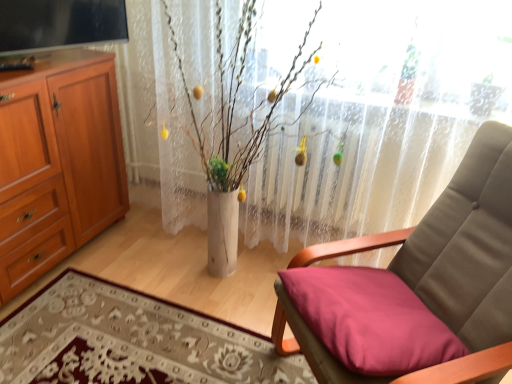
I want to click on matte beige cushion at center right, so click(444, 246).

What do you see at coordinates (369, 320) in the screenshot?
I see `matte pink cushion at lower right` at bounding box center [369, 320].

Identify the location of matte pink cushion at lower right. The height and width of the screenshot is (384, 512). pos(369,320).

Describe the element at coordinates (376, 126) in the screenshot. This screenshot has width=512, height=384. I see `white sheer curtain at center` at that location.

This screenshot has width=512, height=384. Find the location of `white sheer curtain at center`. white sheer curtain at center is located at coordinates (376, 126).

This screenshot has height=384, width=512. Describe the element at coordinates (131, 341) in the screenshot. I see `smooth fabric cushion at lower right` at that location.

Where is `matte beige cushion at center right`? The height and width of the screenshot is (384, 512). matte beige cushion at center right is located at coordinates (444, 246).

What are the coordinates of `cabinetry below the white sheer curtain at center (from the image's perspective)` in the screenshot? It's located at (57, 164).

From the picture: Between wooden cabinet at left and white sheer curtain at center, which one is positioned in front?

white sheer curtain at center.

Is point (116, 185) closer or farther from the camera than point (433, 146)?

Point (116, 185) is positioned farther from the camera compared to point (433, 146).

Consider the image. From the image's perspective, is matte beige cushion at center right positioned above or below matte pink cushion at lower right?

From the image's perspective, matte beige cushion at center right appears above matte pink cushion at lower right.

Does matte beige cushion at center right have a greater height compared to matte pink cushion at lower right?

Correct, matte beige cushion at center right is much taller as matte pink cushion at lower right.

Can you confirm if matte beige cushion at center right is positioned to the left of matte pink cushion at lower right?

In fact, matte beige cushion at center right is to the right of matte pink cushion at lower right.

Identify the location of chair above the matte pink cushion at lower right (from the image's perspective). This screenshot has height=384, width=512. (444, 246).

Which object is wider, smooth fabric cushion at lower right or white sheer curtain at center?

smooth fabric cushion at lower right is wider.

In the scene shown: What's the angular difference between smooth fabric cushion at lower right and white sheer curtain at center's facing directions?

The angle between the facing direction of smooth fabric cushion at lower right and the facing direction of white sheer curtain at center is 90.6 degrees.

Is smooth fabric cushion at lower right facing towards white sheer curtain at center?

No, smooth fabric cushion at lower right does not turn towards white sheer curtain at center.

Between smooth fabric cushion at lower right and white sheer curtain at center, which one is positioned behind?

white sheer curtain at center is further from the camera.

The image size is (512, 384). What are the coordinates of `plain below the white sheer curtain at center (from a real-world perspective)` in the screenshot? It's located at (131, 341).

Is white sheer curtain at center bigger or smaller than smooth fabric cushion at lower right?

Considering their sizes, white sheer curtain at center takes up more space than smooth fabric cushion at lower right.

Can you confirm if white sheer curtain at center is thinner than smooth fabric cushion at lower right?

Yes.

From the image's perspective, is matte beige cushion at center right located above smooth fabric cushion at lower right?

Correct, matte beige cushion at center right appears higher than smooth fabric cushion at lower right in the image.

Is matte beige cushion at center right with smooth fabric cushion at lower right?

matte beige cushion at center right and smooth fabric cushion at lower right are clearly separated.

Does point (451, 325) come in front of point (75, 380)?

Yes.

Between matte beige cushion at center right and smooth fabric cushion at lower right, which one has smaller width?

matte beige cushion at center right.

From a real-world perspective, who is located lower, matte pink cushion at lower right or smooth fabric cushion at lower right?

From a 3D spatial view, smooth fabric cushion at lower right is below.

Between matte pink cushion at lower right and smooth fabric cushion at lower right, which one has more height?

matte pink cushion at lower right.

Consider the image. Is matte pink cushion at lower right not close to smooth fabric cushion at lower right?

No.

Is matte pink cushion at lower right oriented towards smooth fabric cushion at lower right?

No.

Based on the photo, between matte pink cushion at lower right and white sheer curtain at center, which one is positioned in front?

Positioned in front is matte pink cushion at lower right.

Is matte pink cushion at lower right not near white sheer curtain at center?

They are positioned close to each other.

Could you tell me if matte pink cushion at lower right is facing white sheer curtain at center?

No, matte pink cushion at lower right is not oriented towards white sheer curtain at center.

The image size is (512, 384). In order to click on pillow on the right side of white sheer curtain at center in this screenshot , I will do `click(369, 320)`.

The width and height of the screenshot is (512, 384). I want to click on curtain in front of the wooden cabinet at left, so click(376, 126).

Find the location of `chair lying on the right of matte pink cushion at lower right`. chair lying on the right of matte pink cushion at lower right is located at coordinates (444, 246).

In the scene shown: When comparing their distances from white sheer curtain at center, does matte beige cushion at center right or wooden cabinet at left seem closer?

matte beige cushion at center right is positioned closer to the anchor white sheer curtain at center.

Looking at the image, which one is located further to wooden cabinet at left, white sheer curtain at center or smooth fabric cushion at lower right?

Among the two, white sheer curtain at center is located further to wooden cabinet at left.

Estimate the real-world distances between objects in this image. Which object is further from smooth fabric cushion at lower right, matte pink cushion at lower right or wooden cabinet at left?

wooden cabinet at left lies further to smooth fabric cushion at lower right than the other object.

Estimate the real-world distances between objects in this image. Which object is further from smooth fabric cushion at lower right, wooden cabinet at left or white sheer curtain at center?

The object further to smooth fabric cushion at lower right is white sheer curtain at center.

When comparing their distances from matte pink cushion at lower right, does smooth fabric cushion at lower right or wooden cabinet at left seem further?

The object further to matte pink cushion at lower right is wooden cabinet at left.

When comparing their distances from matte beige cushion at center right, does white sheer curtain at center or smooth fabric cushion at lower right seem closer?

white sheer curtain at center lies closer to matte beige cushion at center right than the other object.

Consider the image. Which object lies nearer to the anchor point wooden cabinet at left, white sheer curtain at center or matte pink cushion at lower right?

white sheer curtain at center.

Considering their positions, is matte beige cushion at center right positioned further to smooth fabric cushion at lower right than wooden cabinet at left?

Based on the image, matte beige cushion at center right appears to be further to smooth fabric cushion at lower right.

Where is `chair that lies between white sheer curtain at center and matte pink cushion at lower right from top to bottom`? chair that lies between white sheer curtain at center and matte pink cushion at lower right from top to bottom is located at coordinates (444, 246).

Identify the location of curtain between wooden cabinet at left and matte beige cushion at center right. (376, 126).

At what (x,y) coordinates should I click in order to perform the action: click on curtain between wooden cabinet at left and matte pink cushion at lower right from left to right. Please return your answer as a coordinate pair (x, y). Looking at the image, I should click on (376, 126).

Where is `pillow located between wooden cabinet at left and matte beige cushion at center right in the left-right direction`? The width and height of the screenshot is (512, 384). pillow located between wooden cabinet at left and matte beige cushion at center right in the left-right direction is located at coordinates (369, 320).